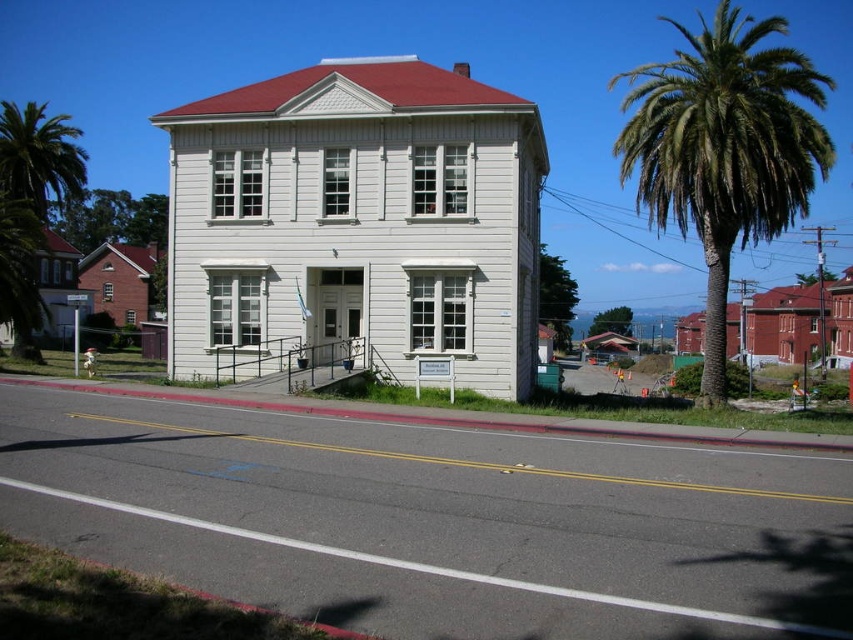
You are standing at the front entrance of the two story white building with red roof. You want to locate the green leafy palm tree at right. In which direction should you look relative to the building?

The green leafy palm tree at right is located at coordinate point (724, 148) relative to the building, so you should look to the right side of the building to find it.